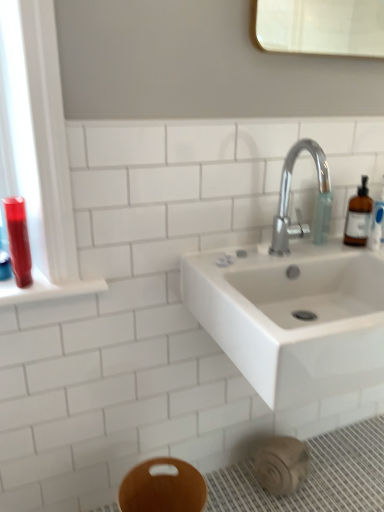
You are a GUI agent. You are given a task and a screenshot of the screen. Output one action in this format:
    pyautogui.click(x=<x>, y=<y>)
    Task: Click on the free space to the left of translucent plastic soap dispenser at upper right
    The width and height of the screenshot is (384, 512).
    Given the screenshot: What is the action you would take?
    pyautogui.click(x=291, y=246)